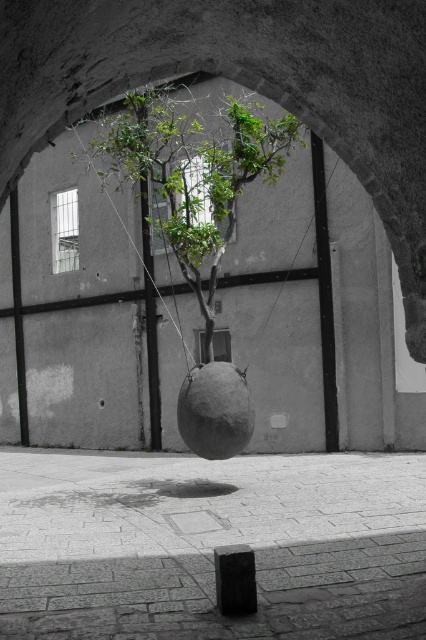
Question: Which object is farther from the camera taking this photo?

Choices:
 (A) green leafy plant at center
 (B) black matte string at center
 (C) black stone at lower center

Answer: (A)

Question: Is green leafy plant at center smaller than black matte string at center?

Choices:
 (A) no
 (B) yes

Answer: (B)

Question: Which object appears farthest from the camera in this image?

Choices:
 (A) green leafy tree at center
 (B) black stone at lower center
 (C) black matte string at center
 (D) green leafy plant at center

Answer: (D)

Question: Does green leafy tree at center lie in front of black matte string at center?

Choices:
 (A) no
 (B) yes

Answer: (B)

Question: Among these objects, which one is farthest from the camera?

Choices:
 (A) black matte string at center
 (B) green leafy tree at center
 (C) green leafy plant at center

Answer: (C)

Question: Considering the relative positions of green leafy tree at center and black stone at lower center in the image provided, where is green leafy tree at center located with respect to black stone at lower center?

Choices:
 (A) right
 (B) left

Answer: (B)